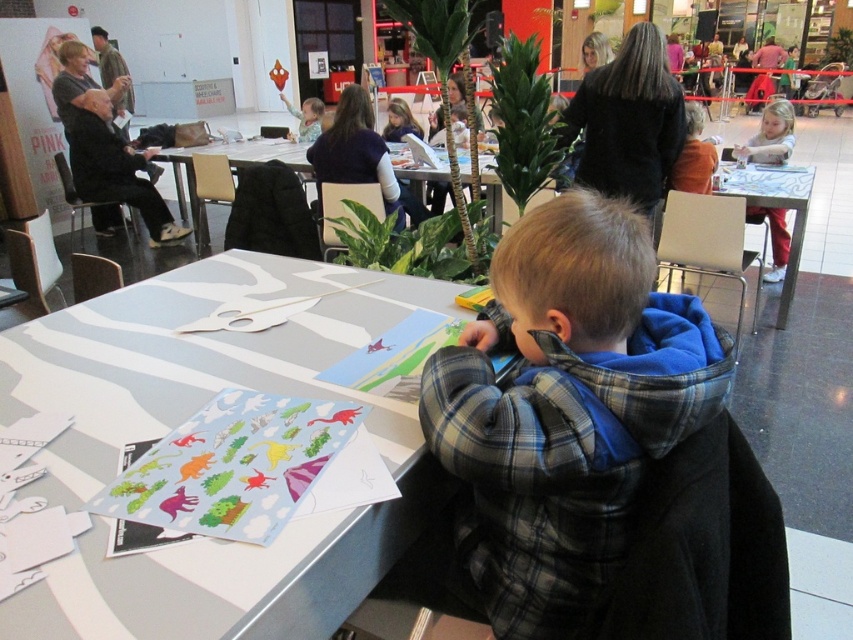
Question: Among these points, which one is nearest to the camera?

Choices:
 (A) (248, 570)
 (B) (782, 216)
 (C) (683, 184)

Answer: (A)

Question: Is plaid flannel shirt at center below white glossy table at right?

Choices:
 (A) no
 (B) yes

Answer: (B)

Question: Is white paper at center thinner than white glossy table at right?

Choices:
 (A) yes
 (B) no

Answer: (B)

Question: Among these points, which one is farthest from the camera?

Choices:
 (A) (486, 577)
 (B) (793, 172)
 (C) (195, 221)
 (D) (254, 260)

Answer: (C)

Question: Which point appears farthest from the camera in this image?

Choices:
 (A) (654, 413)
 (B) (672, 173)
 (C) (194, 224)

Answer: (C)

Question: Is light brown hair at upper right to the right of orange sweater at upper right from the viewer's perspective?

Choices:
 (A) yes
 (B) no

Answer: (A)